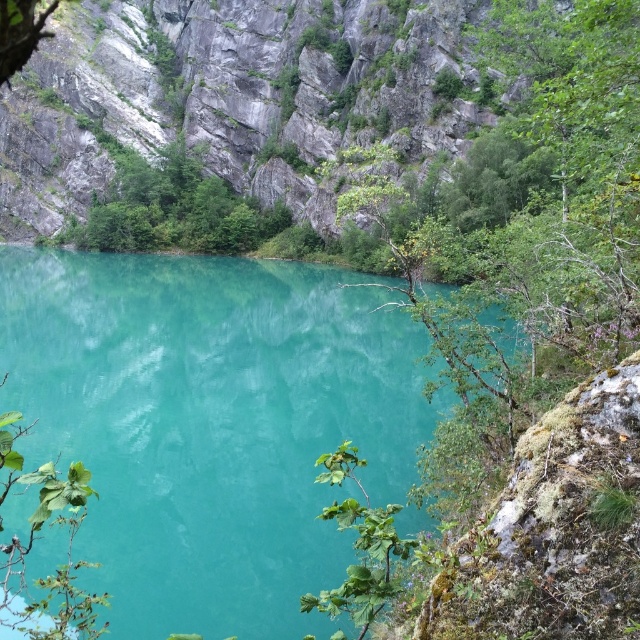
Question: Which object is positioned closest to the green leafy plant at lower right?

Choices:
 (A) green leafy tree at upper center
 (B) green leafy tree at center
 (C) turquoise glossy water at center

Answer: (B)

Question: Is green leafy tree at center further to camera compared to green leafy plant at lower right?

Choices:
 (A) yes
 (B) no

Answer: (B)

Question: Is green leafy tree at upper center positioned at the back of green leafy plant at lower right?

Choices:
 (A) no
 (B) yes

Answer: (B)

Question: Is green leafy tree at center bigger than green leafy plant at lower right?

Choices:
 (A) no
 (B) yes

Answer: (B)

Question: Estimate the real-world distances between objects in this image. Which object is closer to the green leafy tree at upper center?

Choices:
 (A) turquoise glossy water at center
 (B) green leafy tree at center
 (C) green leafy plant at lower right

Answer: (A)

Question: Based on their relative distances, which object is farther from the green leafy plant at lower right?

Choices:
 (A) green leafy tree at upper center
 (B) turquoise glossy water at center

Answer: (A)